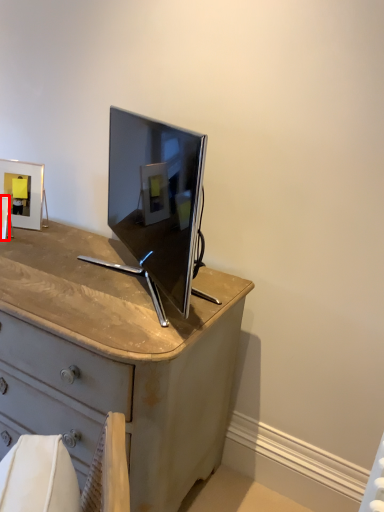
Question: Considering the relative positions of picture frame (annotated by the red box) and picture frame in the image provided, where is picture frame (annotated by the red box) located with respect to the staircase?

Choices:
 (A) right
 (B) left

Answer: (B)